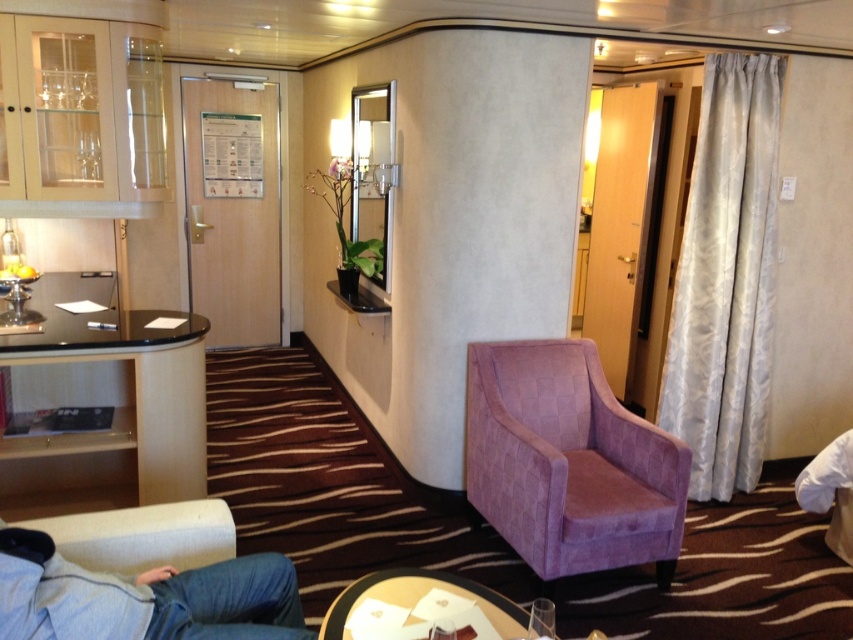
Can you confirm if purple velvet armchair at center is thinner than wooden round table at center?

In fact, purple velvet armchair at center might be wider than wooden round table at center.

From the picture: Can you confirm if purple velvet armchair at center is positioned below wooden round table at center?

Actually, purple velvet armchair at center is above wooden round table at center.

Locate an element on the screen. purple velvet armchair at center is located at coordinates (567, 461).

Is white textured curtain at right shorter than black glass table at left?

No, white textured curtain at right is not shorter than black glass table at left.

Who is more forward, (694, 435) or (61, 484)?

Point (61, 484) is in front.

The height and width of the screenshot is (640, 853). What are the coordinates of `white textured curtain at right` in the screenshot? It's located at (726, 280).

Is purple velvet armchair at center taller than black glass table at left?

No, purple velvet armchair at center is not taller than black glass table at left.

Looking at this image, between purple velvet armchair at center and black glass table at left, which one appears on the left side from the viewer's perspective?

From the viewer's perspective, black glass table at left appears more on the left side.

Measure the distance between point (x=666, y=456) and camera.

9.83 feet

Locate an element on the screen. The width and height of the screenshot is (853, 640). purple velvet armchair at center is located at coordinates (567, 461).